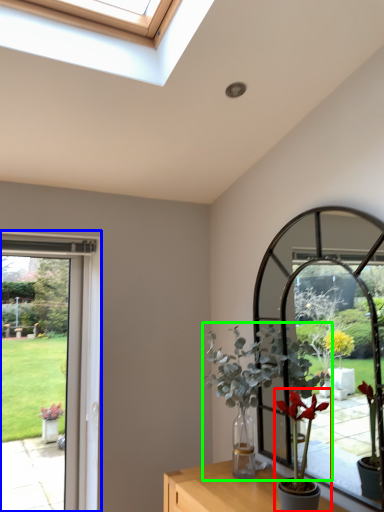
Question: Estimate the real-world distances between objects in this image. Which object is farther from houseplant (highlighted by a red box), window frame (highlighted by a blue box) or houseplant (highlighted by a green box)?

Choices:
 (A) window frame
 (B) houseplant

Answer: (A)